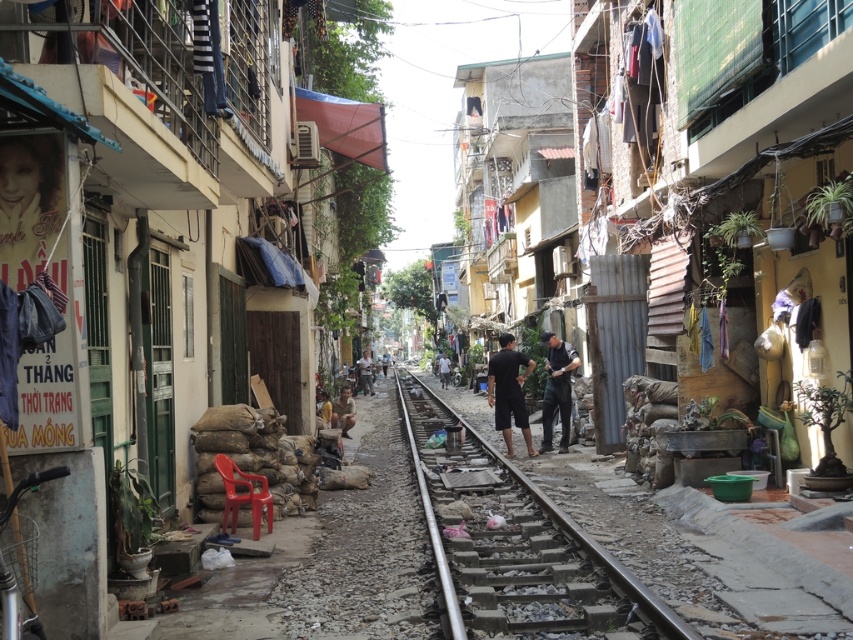
Is red plastic chair at lower left smaller than dark gray fabric at center?

Indeed, red plastic chair at lower left has a smaller size compared to dark gray fabric at center.

What do you see at coordinates (242, 493) in the screenshot? I see `red plastic chair at lower left` at bounding box center [242, 493].

Where is `red plastic chair at lower left`? This screenshot has width=853, height=640. red plastic chair at lower left is located at coordinates (242, 493).

Which is in front, point (518, 417) or point (347, 387)?

Point (518, 417) is in front.

Where is `black matte shorts at center`? black matte shorts at center is located at coordinates (x=509, y=392).

Is point (521, 406) closer to viewer compared to point (347, 426)?

Yes.

Where is `black matte shorts at center`? Image resolution: width=853 pixels, height=640 pixels. black matte shorts at center is located at coordinates (509, 392).

Is point (552, 346) positioned before point (343, 401)?

Yes, it is in front of point (343, 401).

Is dark blue fabric at center thinner than brown fabric pants at center?

Indeed, dark blue fabric at center has a lesser width compared to brown fabric pants at center.

Is point (552, 401) more distant than point (343, 396)?

No, (552, 401) is in front of (343, 396).

Where is `dark blue fabric at center`? The height and width of the screenshot is (640, 853). dark blue fabric at center is located at coordinates (556, 388).